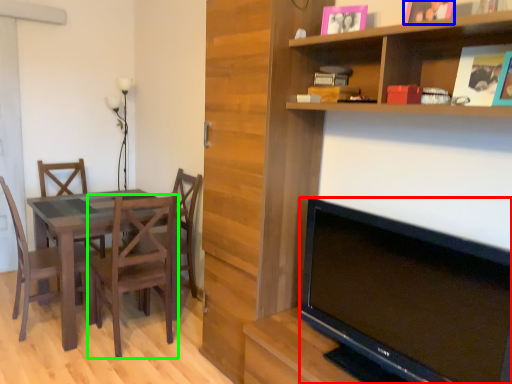
Question: Which object is positioned farthest from television (highlighted by a red box)? Select from picture frame (highlighted by a blue box) and chair (highlighted by a green box).

Choices:
 (A) picture frame
 (B) chair

Answer: (B)